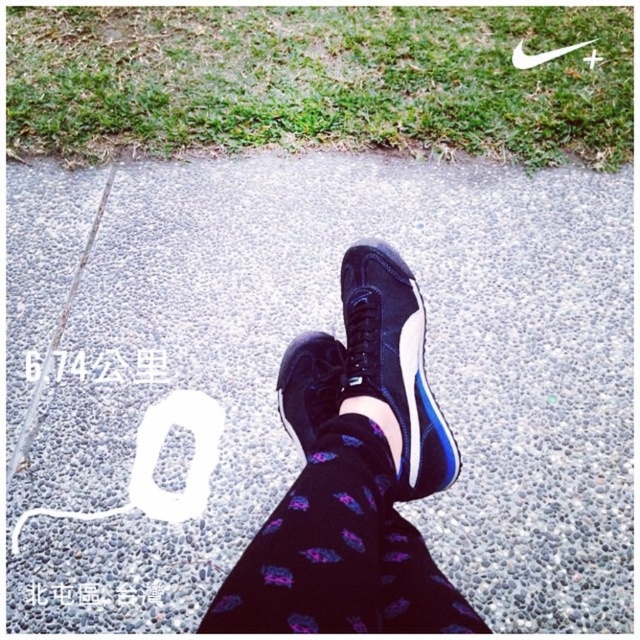
Does black rubber pavement at center have a smaller size compared to black leather sneaker at center?

Incorrect, black rubber pavement at center is not smaller in size than black leather sneaker at center.

Who is more distant from viewer, (x=589, y=544) or (x=310, y=392)?

The point (x=589, y=544) is behind.

At what (x,y) coordinates should I click in order to perform the action: click on black rubber pavement at center. Please return your answer as a coordinate pair (x, y). The height and width of the screenshot is (640, 640). Looking at the image, I should click on (276, 369).

Can you confirm if black rubber pavement at center is shorter than black synthetic sneaker at center?

Incorrect, black rubber pavement at center's height does not fall short of black synthetic sneaker at center's.

Based on the photo, who is more distant from viewer, [554,380] or [388,298]?

The point [554,380] is more distant.

Measure the distance between black rubber pavement at center and camera.

black rubber pavement at center and camera are 1.23 meters apart.

Image resolution: width=640 pixels, height=640 pixels. I want to click on black rubber pavement at center, so click(x=276, y=369).

Does black rubber pavement at center appear on the right side of matte black sneakers at center?

No, black rubber pavement at center is not to the right of matte black sneakers at center.

Does black rubber pavement at center appear over matte black sneakers at center?

Yes.

Measure the distance between point (244, 413) and camera.

Point (244, 413) is 4.89 feet away from camera.

Where is `black rubber pavement at center`? black rubber pavement at center is located at coordinates (276, 369).